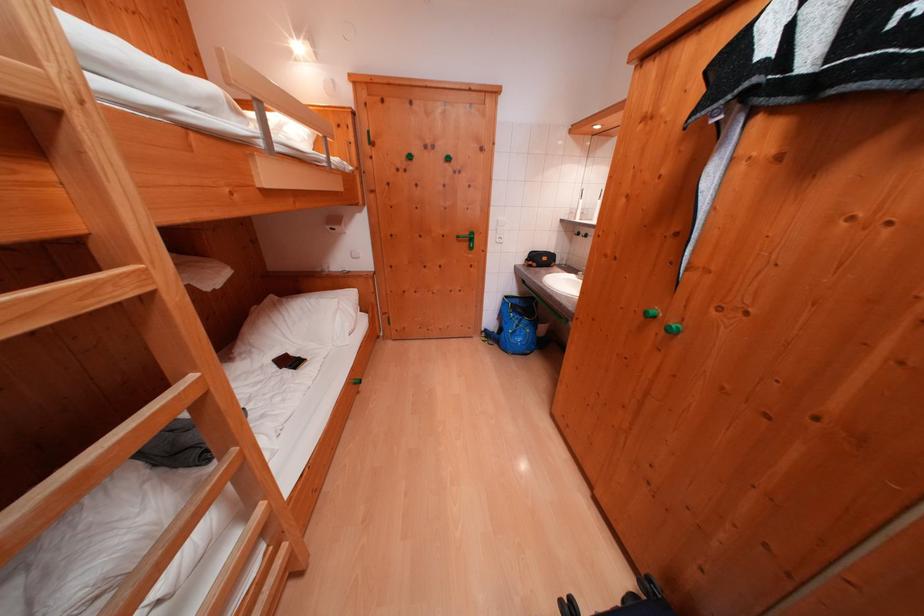
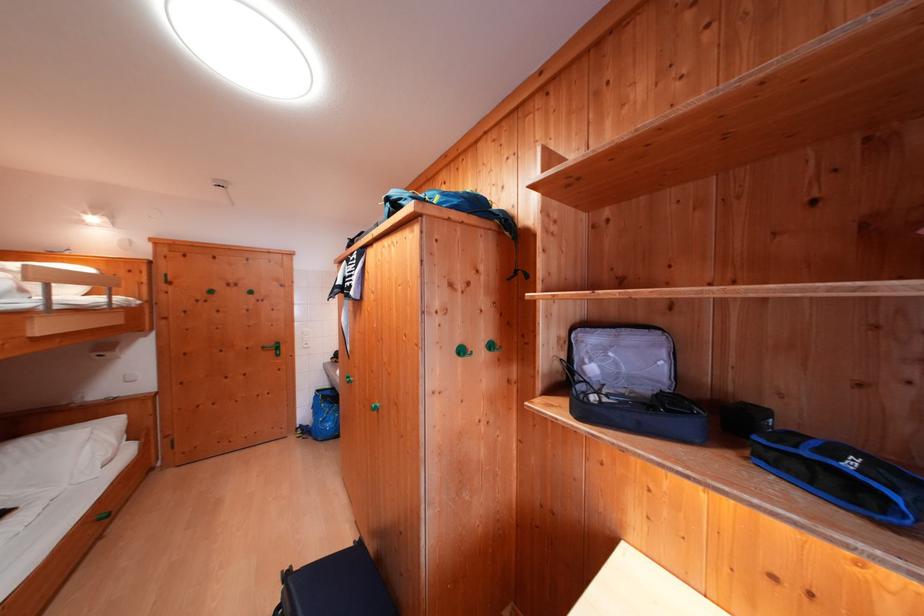
Find the pixel in the second image that matches [344,305] in the first image.

(96, 434)